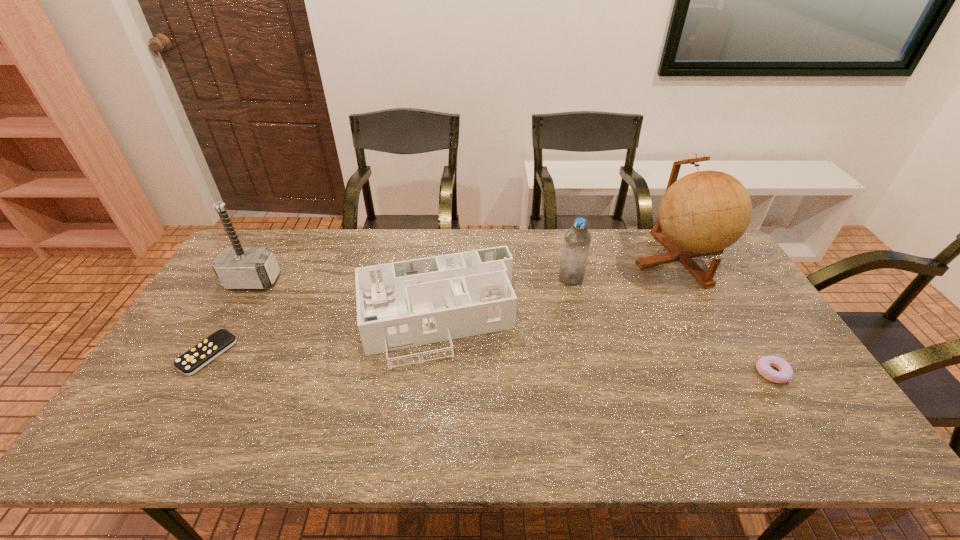
Image resolution: width=960 pixels, height=540 pixels. I want to click on unoccupied area between the third object from left to right and the shortest object, so click(322, 336).

This screenshot has height=540, width=960. What are the coordinates of `vacant space that is in between the remote control and the doughnut` in the screenshot? It's located at (491, 363).

This screenshot has width=960, height=540. I want to click on free space between the hammer and the remote control, so click(230, 318).

Locate an element on the screen. free space between the remote control and the hammer is located at coordinates (230, 318).

Point out which object is positioned as the nearest to the third object from right to left. Please provide its 2D coordinates. Your answer should be formatted as a tuple, i.e. [(x, y)], where the tuple contains the x and y coordinates of a point satisfying the conditions above.

[(403, 304)]

Locate an element on the screen. object that stands as the fourth closest to the doughnut is located at coordinates (196, 358).

I want to click on free space that satisfies the following two spatial constraints: 1. on the back side of the dollhouse; 2. on the left side of the water bottle, so click(439, 279).

I want to click on free spot that satisfies the following two spatial constraints: 1. for striking with the head of the hammer; 2. on the right side of the doughnut, so click(199, 373).

Identify the location of vacant region that satisfies the following two spatial constraints: 1. on the surface of the tallest object; 2. on the left side of the second shortest object. This screenshot has height=540, width=960. (742, 373).

Locate an element on the screen. The width and height of the screenshot is (960, 540). vacant area in the image that satisfies the following two spatial constraints: 1. on the back side of the fourth object from right to left; 2. on the right side of the water bottle is located at coordinates (439, 279).